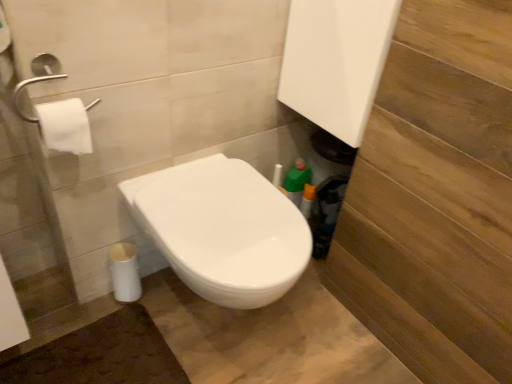
Where is `blank space situated above white glossy toilet at center (from a real-world perspective)`? blank space situated above white glossy toilet at center (from a real-world perspective) is located at coordinates (221, 199).